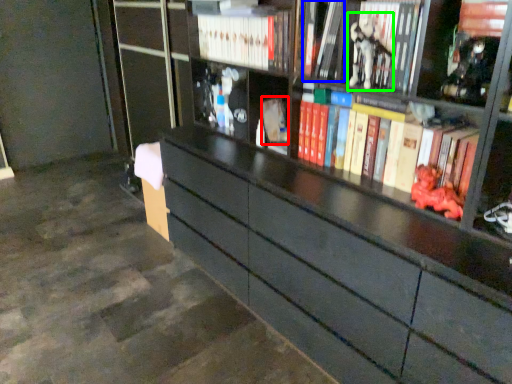
Question: Which object is positioned farthest from paperback book (highlighted by a red box)? Select from book (highlighted by a blue box) and toy (highlighted by a green box).

Choices:
 (A) book
 (B) toy

Answer: (B)